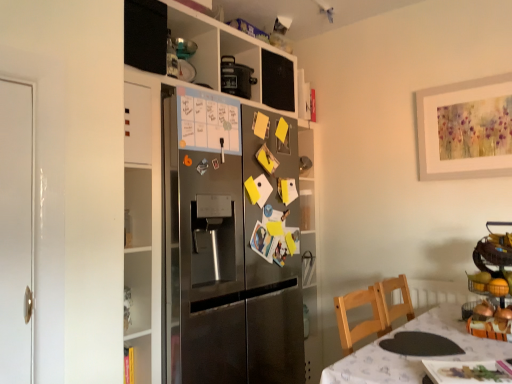
Measure the distance between stainless steel refrigerator at center and camera.

A distance of 1.74 meters exists between stainless steel refrigerator at center and camera.

Image resolution: width=512 pixels, height=384 pixels. Describe the element at coordinates (492, 284) in the screenshot. I see `metallic fruit basket at right` at that location.

Describe the element at coordinates (489, 284) in the screenshot. I see `orange matte fruit basket at right` at that location.

In order to face white fabric table at lower right, should I rotate leftwards or rightwards?

It's best to rotate right around 24.161 degrees.

Where is `stainless steel refrigerator at center`? This screenshot has width=512, height=384. stainless steel refrigerator at center is located at coordinates (218, 213).

What's the angular difference between orange matte fruit basket at right and stainless steel refrigerator at center's facing directions?

88.4 degrees separate the facing orientations of orange matte fruit basket at right and stainless steel refrigerator at center.

Can we say orange matte fruit basket at right lies outside stainless steel refrigerator at center?

Yes, orange matte fruit basket at right is located beyond the bounds of stainless steel refrigerator at center.

From a real-world perspective, which is physically below, orange matte fruit basket at right or stainless steel refrigerator at center?

In real-world perspective, orange matte fruit basket at right is lower.

From their relative heights in the image, would you say orange matte fruit basket at right is taller or shorter than stainless steel refrigerator at center?

In the image, orange matte fruit basket at right appears to be shorter than stainless steel refrigerator at center.

In terms of height, does white fabric table at lower right look taller or shorter compared to metallic fruit basket at right?

Considering their sizes, white fabric table at lower right has more height than metallic fruit basket at right.

Would you say white fabric table at lower right is a long distance from metallic fruit basket at right?

No, white fabric table at lower right is in close proximity to metallic fruit basket at right.

The image size is (512, 384). Identify the location of table below the metallic fruit basket at right (from the image's perspective). (413, 357).

Looking at their sizes, would you say metallic fruit basket at right is wider or thinner than orange matte fruit basket at right?

Considering their sizes, metallic fruit basket at right looks broader than orange matte fruit basket at right.

From the image's perspective, does metallic fruit basket at right appear lower than orange matte fruit basket at right?

Incorrect, from the image's perspective, metallic fruit basket at right is higher than orange matte fruit basket at right.

Who is shorter, metallic fruit basket at right or orange matte fruit basket at right?

orange matte fruit basket at right is shorter.

Locate an element on the screen. The width and height of the screenshot is (512, 384). appliance lying above the orange matte fruit basket at right (from the image's perspective) is located at coordinates (492, 284).

Are white fabric table at lower right and stainless steel refrigerator at center far apart?

No, white fabric table at lower right is not far from stainless steel refrigerator at center.

Is white fabric table at lower right oriented towards stainless steel refrigerator at center?

No, white fabric table at lower right is not turned towards stainless steel refrigerator at center.

This screenshot has height=384, width=512. In order to click on table on the right of stainless steel refrigerator at center in this screenshot , I will do `click(413, 357)`.

From the image's perspective, is white fabric table at lower right on stainless steel refrigerator at center?

No, from the image's perspective, white fabric table at lower right is not over stainless steel refrigerator at center.

Who is shorter, white fabric table at lower right or orange matte fruit basket at right?

Standing shorter between the two is orange matte fruit basket at right.

Can you see white fabric table at lower right touching orange matte fruit basket at right?

No, white fabric table at lower right is not touching orange matte fruit basket at right.

Which object is positioned more to the right, white fabric table at lower right or orange matte fruit basket at right?

Positioned to the right is orange matte fruit basket at right.

Where is `table located below the orange matte fruit basket at right (from the image's perspective)`? table located below the orange matte fruit basket at right (from the image's perspective) is located at coordinates (x=413, y=357).

Would you say stainless steel refrigerator at center is a long distance from orange matte fruit basket at right?

Indeed, stainless steel refrigerator at center is not near orange matte fruit basket at right.

From a real-world perspective, which object rests below the other?

Result: In real-world perspective, orange matte fruit basket at right is lower.

Is stainless steel refrigerator at center smaller than orange matte fruit basket at right?

Actually, stainless steel refrigerator at center might be larger than orange matte fruit basket at right.

Can you tell me how much stainless steel refrigerator at center and orange matte fruit basket at right differ in facing direction?

88.4 degrees separate the facing orientations of stainless steel refrigerator at center and orange matte fruit basket at right.

Is stainless steel refrigerator at center at the right side of metallic fruit basket at right?

In fact, stainless steel refrigerator at center is to the left of metallic fruit basket at right.

Can you confirm if stainless steel refrigerator at center is thinner than metallic fruit basket at right?

No.

Is stainless steel refrigerator at center facing towards metallic fruit basket at right?

Yes.

Find the location of a particular element. The image size is (512, 384). cabinetry on the left side of orange matte fruit basket at right is located at coordinates click(218, 213).

Where is `table in front of the metallic fruit basket at right`? table in front of the metallic fruit basket at right is located at coordinates (413, 357).

Considering their positions, is stainless steel refrigerator at center positioned closer to white fabric table at lower right than orange matte fruit basket at right?

orange matte fruit basket at right.

When comparing their distances from metallic fruit basket at right, does orange matte fruit basket at right or white fabric table at lower right seem further?

white fabric table at lower right is further to metallic fruit basket at right.

Which object lies nearer to the anchor point metallic fruit basket at right, white fabric table at lower right or stainless steel refrigerator at center?

white fabric table at lower right lies closer to metallic fruit basket at right than the other object.

Looking at the image, which one is located closer to orange matte fruit basket at right, white fabric table at lower right or stainless steel refrigerator at center?

Among the two, white fabric table at lower right is located nearer to orange matte fruit basket at right.

Based on their spatial positions, is stainless steel refrigerator at center or white fabric table at lower right closer to orange matte fruit basket at right?

white fabric table at lower right.

Estimate the real-world distances between objects in this image. Which object is further from white fabric table at lower right, metallic fruit basket at right or stainless steel refrigerator at center?

stainless steel refrigerator at center.

From the image, which object appears to be farther from stainless steel refrigerator at center, metallic fruit basket at right or orange matte fruit basket at right?

The object further to stainless steel refrigerator at center is orange matte fruit basket at right.

Which object lies further to the anchor point orange matte fruit basket at right, metallic fruit basket at right or white fabric table at lower right?

Among the two, white fabric table at lower right is located further to orange matte fruit basket at right.

The image size is (512, 384). What are the coordinates of `table between stainless steel refrigerator at center and orange matte fruit basket at right from left to right` in the screenshot? It's located at (413, 357).

This screenshot has width=512, height=384. What are the coordinates of `food between white fabric table at lower right and metallic fruit basket at right in the front-back direction` in the screenshot? It's located at (489, 284).

This screenshot has width=512, height=384. I want to click on appliance between stainless steel refrigerator at center and orange matte fruit basket at right, so click(492, 284).

Find the location of a particular element. The width and height of the screenshot is (512, 384). table between stainless steel refrigerator at center and metallic fruit basket at right from left to right is located at coordinates (413, 357).